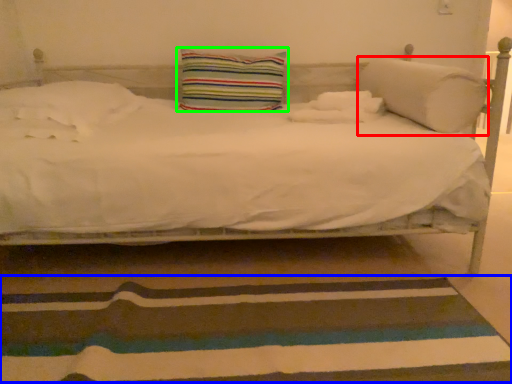
Question: Considering the real-world distances, which object is farthest from pillow (highlighted by a red box)? doormat (highlighted by a blue box) or pillow (highlighted by a green box)?

Choices:
 (A) doormat
 (B) pillow

Answer: (A)